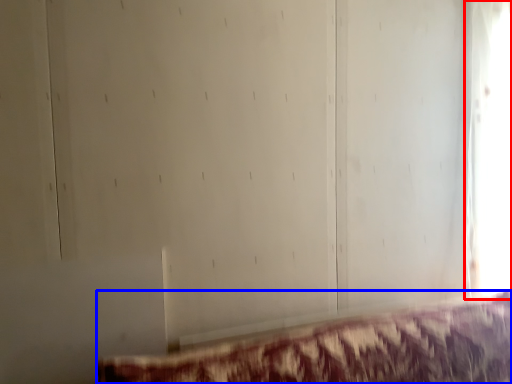
Question: Which object is further to the camera taking this photo, window (highlighted by a red box) or furniture (highlighted by a blue box)?

Choices:
 (A) window
 (B) furniture

Answer: (A)